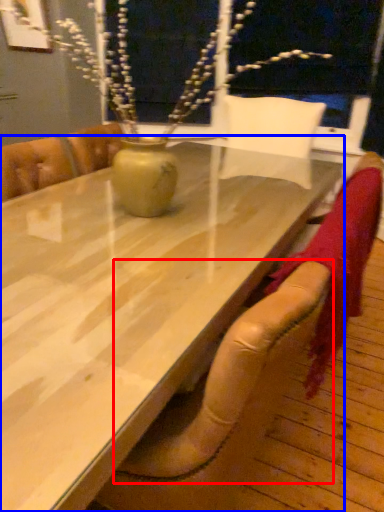
Question: Among these objects, which one is farthest to the camera, armchair (highlighted by a red box) or table (highlighted by a blue box)?

Choices:
 (A) armchair
 (B) table

Answer: (A)